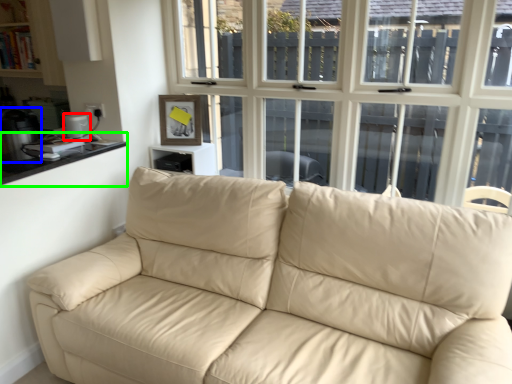
Question: Based on their relative distances, which object is farther from appliance (highlighted by a red box)? Choose from appliance (highlighted by a blue box) and counter top (highlighted by a green box).

Choices:
 (A) appliance
 (B) counter top

Answer: (A)